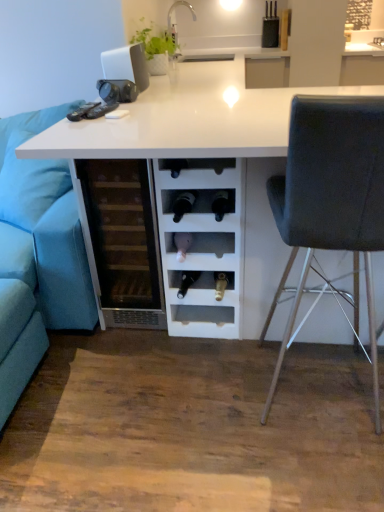
Question: From their relative heights in the image, would you say dark grey fabric chair at right is taller or shorter than blue fabric couch at left?

Choices:
 (A) short
 (B) tall

Answer: (B)

Question: Looking at the image, does dark grey fabric chair at right seem bigger or smaller compared to blue fabric couch at left?

Choices:
 (A) small
 (B) big

Answer: (A)

Question: Which of these objects is positioned farthest from the white glossy table at center?

Choices:
 (A) white matte laptop at upper center
 (B) blue fabric couch at left
 (C) dark grey fabric chair at right
 (D) transparent glass wine cooler at center

Answer: (B)

Question: Which object is positioned closest to the dark grey fabric chair at right?

Choices:
 (A) white glossy table at center
 (B) blue fabric couch at left
 (C) transparent glass wine cooler at center
 (D) white matte laptop at upper center

Answer: (A)